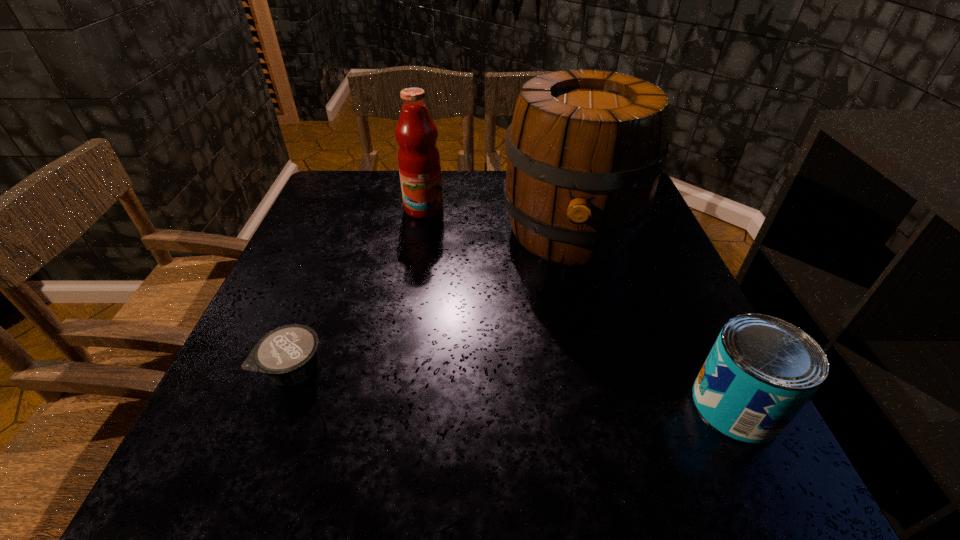
Where is `free space on the desktop that is between the yogurt and the can and is positioned on the front label of the third object from right to left`? This screenshot has height=540, width=960. free space on the desktop that is between the yogurt and the can and is positioned on the front label of the third object from right to left is located at coordinates (450, 382).

Image resolution: width=960 pixels, height=540 pixels. I want to click on free spot on the desktop that is between the shortest object and the third tallest object and is positioned on the side of the cider where the spigot is located, so click(563, 391).